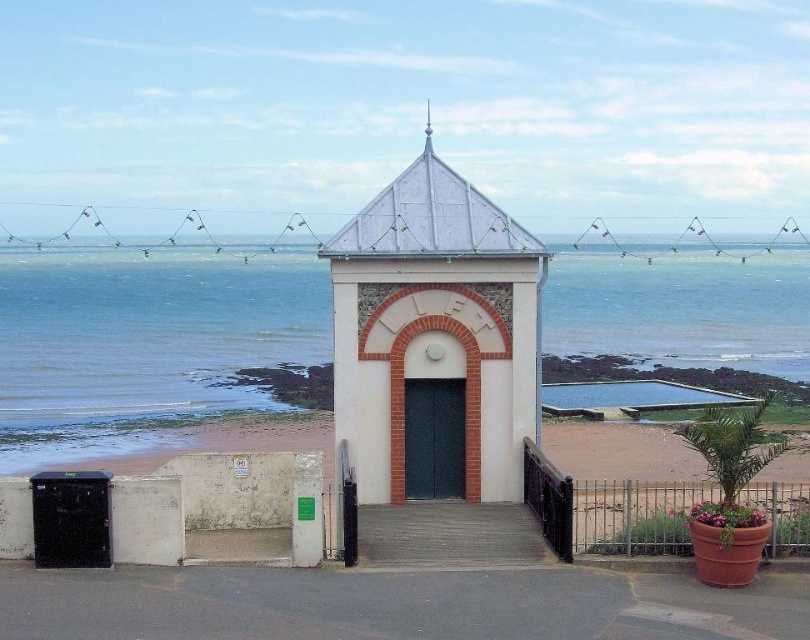
You are standing in front of the white brick building with the metal roof and the sign that says LIFT. You see two points marked in the scene. The first point is at coordinates point (105, 320) and the second point is at point (438, 554). Which point is closer to you?

Point (105, 320) is further to the camera than point (438, 554). Therefore, the point closer to you is point (438, 554).

You are standing at the beach and see the blue water at center and the smooth concrete stairs at center. Which one is higher from the ground?

The blue water at center is taller than the smooth concrete stairs at center, so the blue water at center is higher from the ground.

You are standing at the beach and see the blue water at center and the white matte chapel at center. Which one is taller?

The white matte chapel at center is taller than the blue water at center.